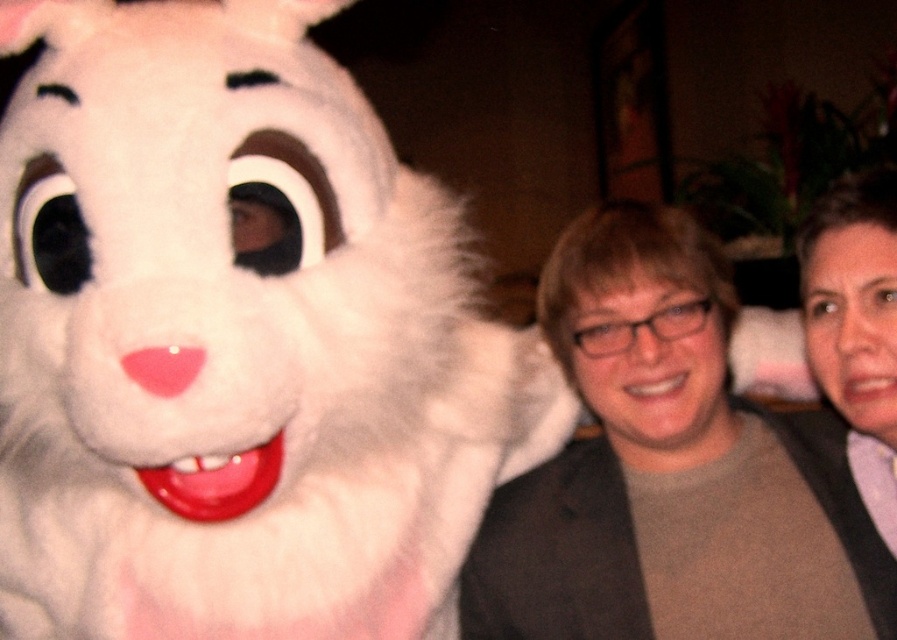
Does fluffy white bunny at left have a larger size compared to matte gray jacket at center?

Indeed, fluffy white bunny at left has a larger size compared to matte gray jacket at center.

Between point (334, 556) and point (774, 563), which one is positioned in front?

Point (334, 556)

You are a GUI agent. You are given a task and a screenshot of the screen. Output one action in this format:
    pyautogui.click(x=<x>, y=<y>)
    Task: Click on the fluffy white bunny at left
    This screenshot has height=640, width=897.
    Given the screenshot: What is the action you would take?
    pyautogui.click(x=236, y=340)

Which of these two, fluffy white bunny at left or matte gray sweater at center, stands taller?

fluffy white bunny at left is taller.

Is fluffy white bunny at left to the right of matte gray sweater at center from the viewer's perspective?

Incorrect, fluffy white bunny at left is not on the right side of matte gray sweater at center.

Where is `fluffy white bunny at left`? This screenshot has height=640, width=897. fluffy white bunny at left is located at coordinates (236, 340).

I want to click on matte gray jacket at center, so click(663, 468).

What are the coordinates of `matte gray jacket at center` in the screenshot? It's located at (663, 468).